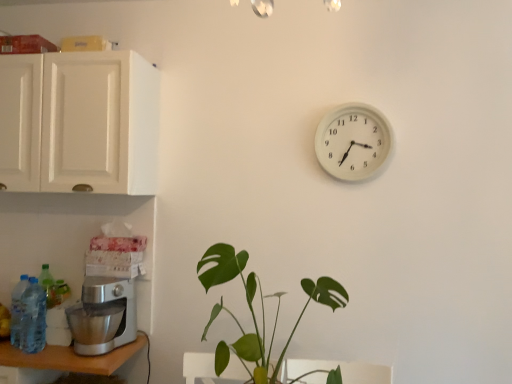
Question: In the image, is silver metallic table at lower left on the left side or the right side of translucent plastic bottle at lower left, positioned as the second bottle in right-to-left order?

Choices:
 (A) right
 (B) left

Answer: (A)

Question: In terms of size, does silver metallic table at lower left appear bigger or smaller than translucent plastic bottle at lower left, positioned as the second bottle in right-to-left order?

Choices:
 (A) big
 (B) small

Answer: (A)

Question: Which object is the farthest from the translucent plastic bottle at lower left, the 1th bottle from the left?

Choices:
 (A) blue plastic bottle at lower left, acting as the 2th bottle starting from the left
 (B) white plastic wall clock at upper right
 (C) white matte cabinet at upper left
 (D) satin silver mixer at lower left
 (E) silver metallic table at lower left

Answer: (B)

Question: Which is farther from the silver metallic table at lower left?

Choices:
 (A) blue plastic bottle at lower left, the 1th bottle viewed from the right
 (B) green matte plant at center
 (C) satin silver mixer at lower left
 (D) white matte cabinet at upper left
 (E) translucent plastic bottle at lower left, the 1th bottle from the left

Answer: (D)